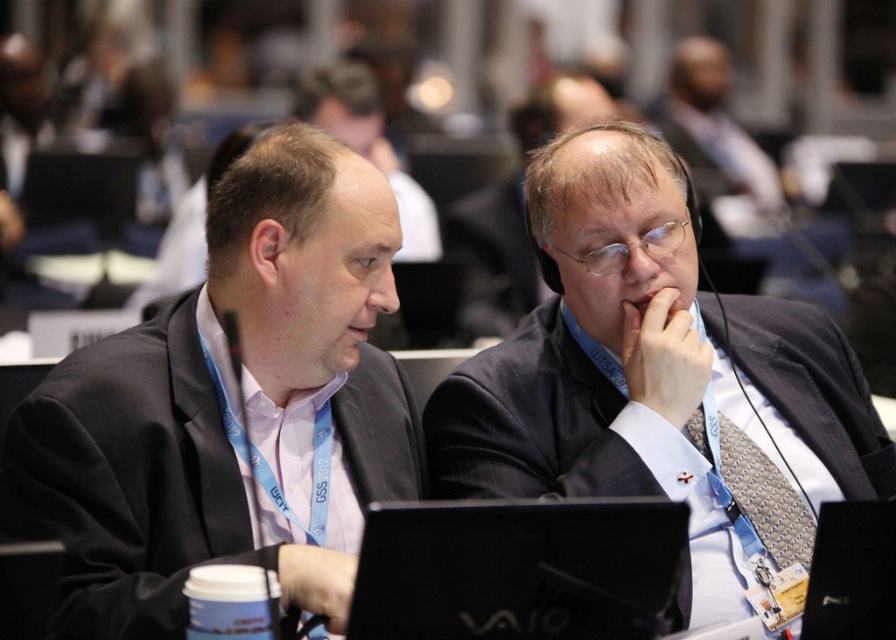
Does black matte laptop at center appear on the right side of matte black suit at left?

Correct, you'll find black matte laptop at center to the right of matte black suit at left.

What do you see at coordinates (519, 570) in the screenshot? I see `black matte laptop at center` at bounding box center [519, 570].

The image size is (896, 640). In order to click on black matte laptop at center in this screenshot , I will do `click(519, 570)`.

Is matte black suit at left to the left of matte black suit at center from the viewer's perspective?

Indeed, matte black suit at left is positioned on the left side of matte black suit at center.

Is point (171, 284) positioned behind point (681, 122)?

That is False.

Identify the location of matte black suit at left. (367, 144).

The width and height of the screenshot is (896, 640). In order to click on black matte laptop at center in this screenshot , I will do `click(519, 570)`.

From the picture: Can you confirm if black matte laptop at center is wider than matte black suit at center?

Incorrect, black matte laptop at center's width does not surpass matte black suit at center's.

Does point (564, 627) lie behind point (757, 163)?

No, it is in front of (757, 163).

Locate an element on the screen. This screenshot has width=896, height=640. black matte laptop at center is located at coordinates (519, 570).